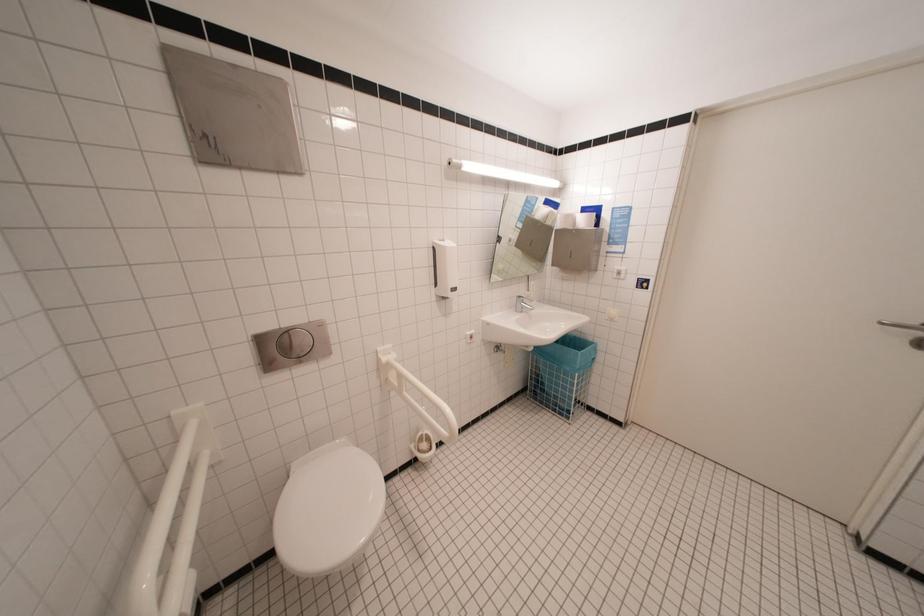
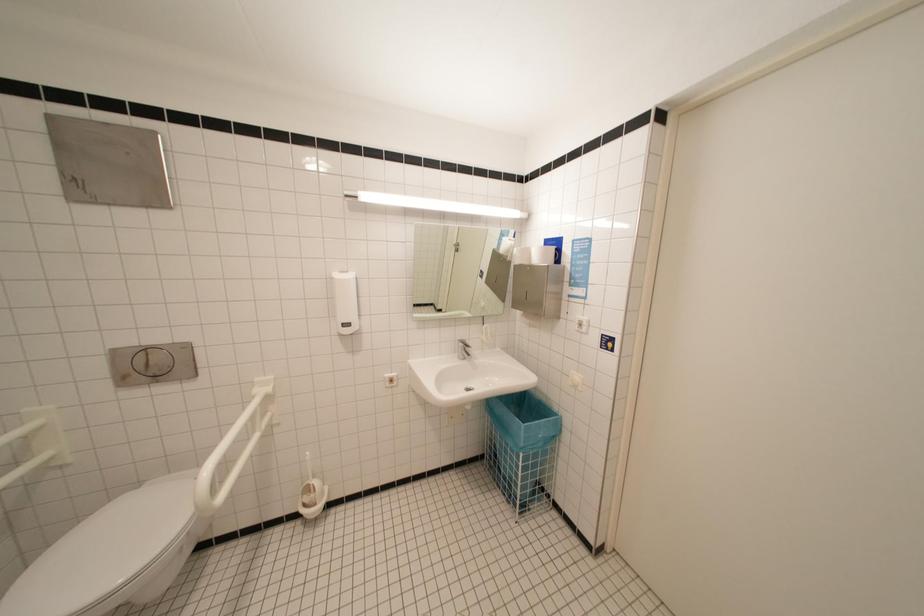
Question: The camera is either moving clockwise (left) or counter-clockwise (right) around the object. The first image is from the beginning of the video and the second image is from the end. Is the camera moving left or right when shooting the video?

Choices:
 (A) Left
 (B) Right

Answer: (B)